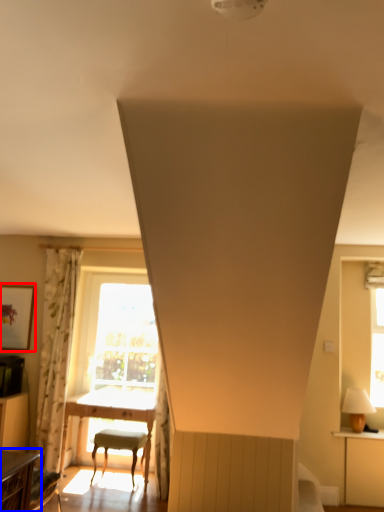
Question: Which object appears farthest to the camera in this image, picture frame (highlighted by a red box) or table (highlighted by a blue box)?

Choices:
 (A) picture frame
 (B) table

Answer: (A)